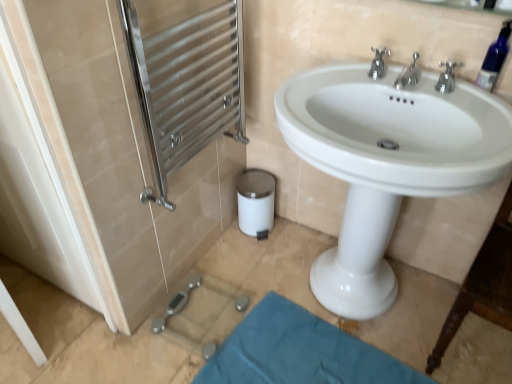
At what (x,y) coordinates should I click in order to perform the action: click on vacant region to the left of polished chrome faucet at upper center, which appears as the 2th tap when viewed from the right. Please return your answer as a coordinate pair (x, y). Image resolution: width=512 pixels, height=384 pixels. Looking at the image, I should click on (350, 86).